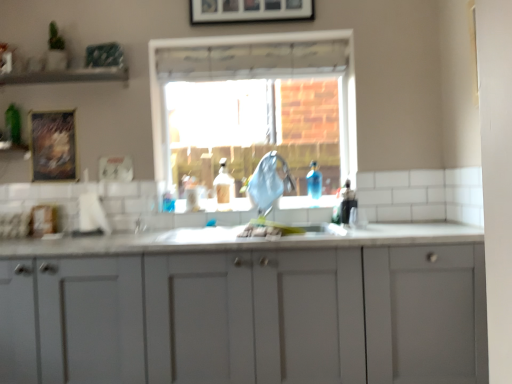
Question: Is wooden framed picture at upper center, marked as the first picture frame in a top-to-bottom arrangement, at the left side of blue fabric at center?

Choices:
 (A) yes
 (B) no

Answer: (A)

Question: From the image's perspective, is wooden framed picture at upper center, positioned as the first picture frame in right-to-left order, on blue fabric at center?

Choices:
 (A) no
 (B) yes

Answer: (B)

Question: Does wooden framed picture at upper center, the second picture frame when ordered from left to right, contain blue fabric at center?

Choices:
 (A) no
 (B) yes

Answer: (A)

Question: Considering the relative positions of wooden framed picture at upper center, which is the 2th picture frame in bottom-to-top order, and blue fabric at center in the image provided, is wooden framed picture at upper center, which is the 2th picture frame in bottom-to-top order, to the right of blue fabric at center from the viewer's perspective?

Choices:
 (A) yes
 (B) no

Answer: (B)

Question: From a real-world perspective, is wooden framed picture at upper center, acting as the first picture frame starting from the front, physically above blue fabric at center?

Choices:
 (A) yes
 (B) no

Answer: (A)

Question: Can you confirm if wooden framed picture at upper center, acting as the 2th picture frame starting from the back, is wider than blue fabric at center?

Choices:
 (A) no
 (B) yes

Answer: (A)

Question: Is white matte cabinet at center shorter than translucent plastic bottle at center?

Choices:
 (A) yes
 (B) no

Answer: (B)

Question: Does white matte cabinet at center lie in front of translucent plastic bottle at center?

Choices:
 (A) no
 (B) yes

Answer: (B)

Question: From the image's perspective, does white matte cabinet at center appear lower than translucent plastic bottle at center?

Choices:
 (A) yes
 (B) no

Answer: (A)

Question: Is white matte cabinet at center in contact with translucent plastic bottle at center?

Choices:
 (A) no
 (B) yes

Answer: (A)

Question: From the image's perspective, is white matte cabinet at center over translucent plastic bottle at center?

Choices:
 (A) no
 (B) yes

Answer: (A)

Question: Considering the relative sizes of white matte cabinet at center and translucent plastic bottle at center in the image provided, is white matte cabinet at center thinner than translucent plastic bottle at center?

Choices:
 (A) no
 (B) yes

Answer: (A)

Question: Would you say wooden textured frame at upper left, placed as the first picture frame when sorted from bottom to top, contains wooden framed picture at upper center, acting as the first picture frame starting from the front?

Choices:
 (A) yes
 (B) no

Answer: (B)